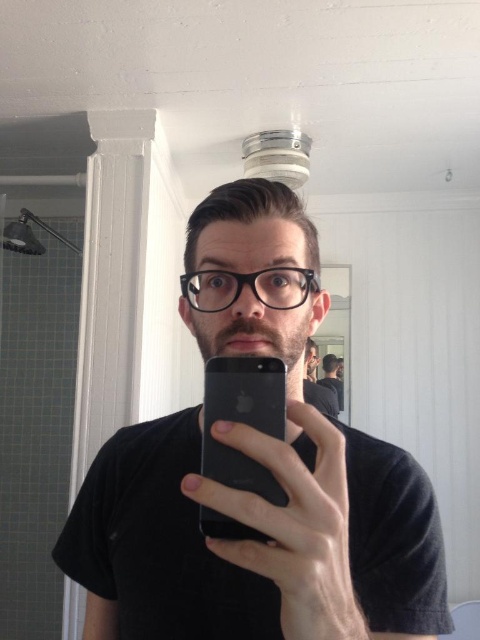
You are trying to take a photo of yourself in the bathroom using your phone. You notice that the matte black phone at center and the black matte shirt at center are both in the frame. Which object is wider in the photo?

The matte black phone at center is wider than the black matte shirt at center in the photo.

You are standing in the bathroom and want to move from the point at coordinates point (141, 620) to the point at coordinates point (205, 512). Can you walk directly between them without any obstacles?

Point point (141, 620) is behind point point (205, 512), so you cannot walk directly between them without obstacles.

You are trying to take a selfie using your phone. You have two devices available in the bathroom scene described. Which device, the matte black phone at center or the black matte smartphone at center, would allow you to capture a wider angle of yourself and the bathroom background?

The matte black phone at center is larger in size than the black matte smartphone at center, so it likely has a wider camera lens, allowing you to capture a wider angle of yourself and the bathroom background.